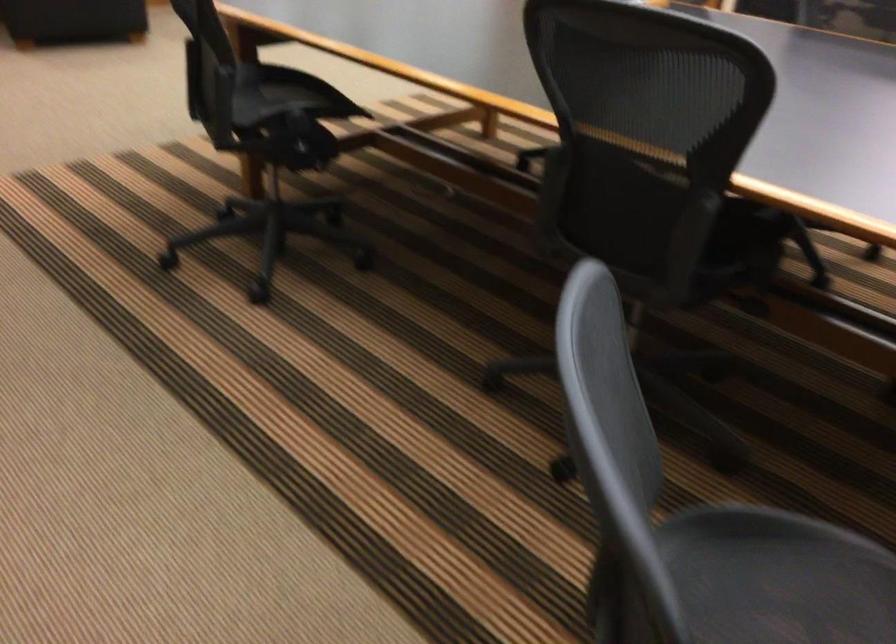
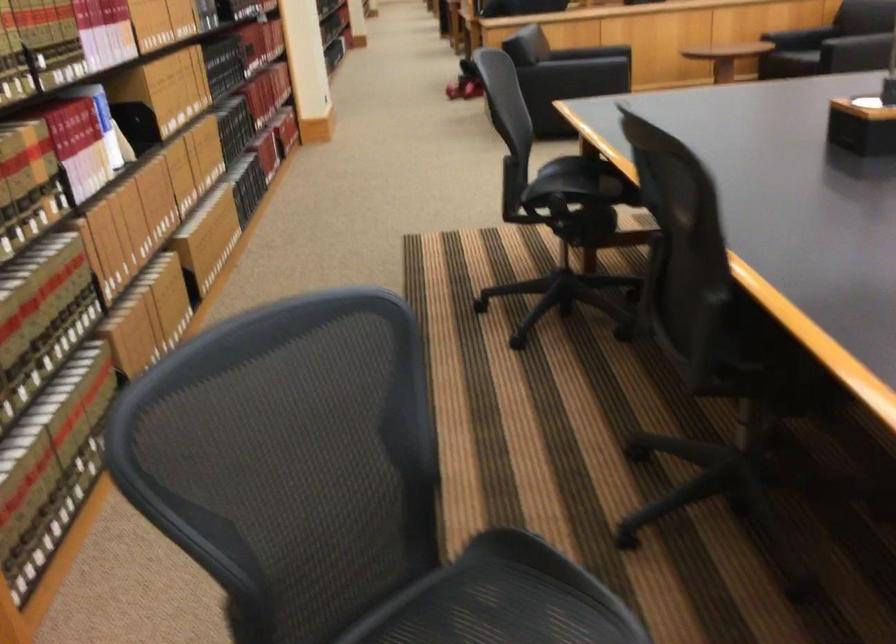
Locate, in the second image, the point that corresponds to (x=743, y=263) in the first image.

(762, 360)